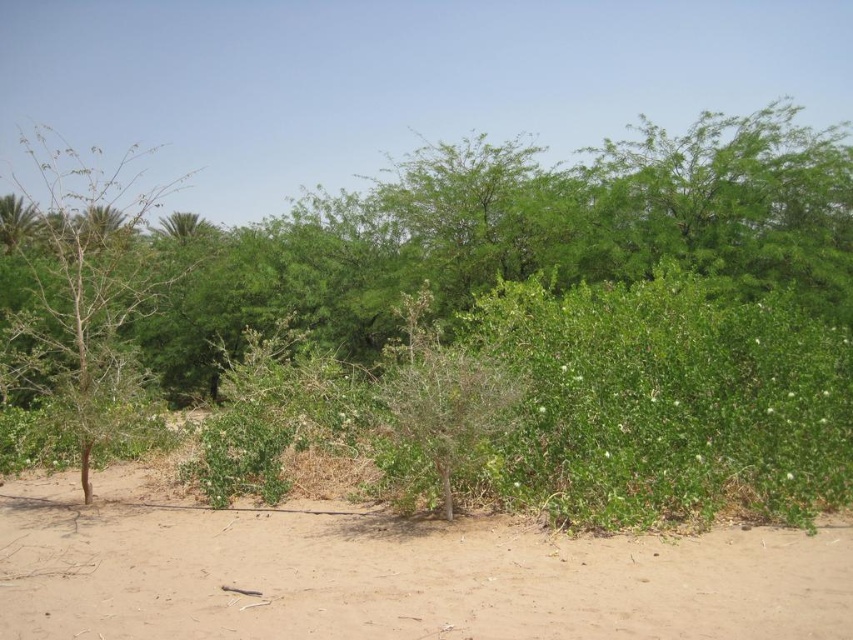
Question: Which point is farther from the camera taking this photo?

Choices:
 (A) (57, 349)
 (B) (318, 573)

Answer: (A)

Question: Can you confirm if brown sandy dirt at center is wider than bare branches at left?

Choices:
 (A) no
 (B) yes

Answer: (A)

Question: Can you confirm if brown sandy dirt at center is bigger than bare branches at left?

Choices:
 (A) yes
 (B) no

Answer: (B)

Question: Is brown sandy dirt at center above bare branches at left?

Choices:
 (A) no
 (B) yes

Answer: (A)